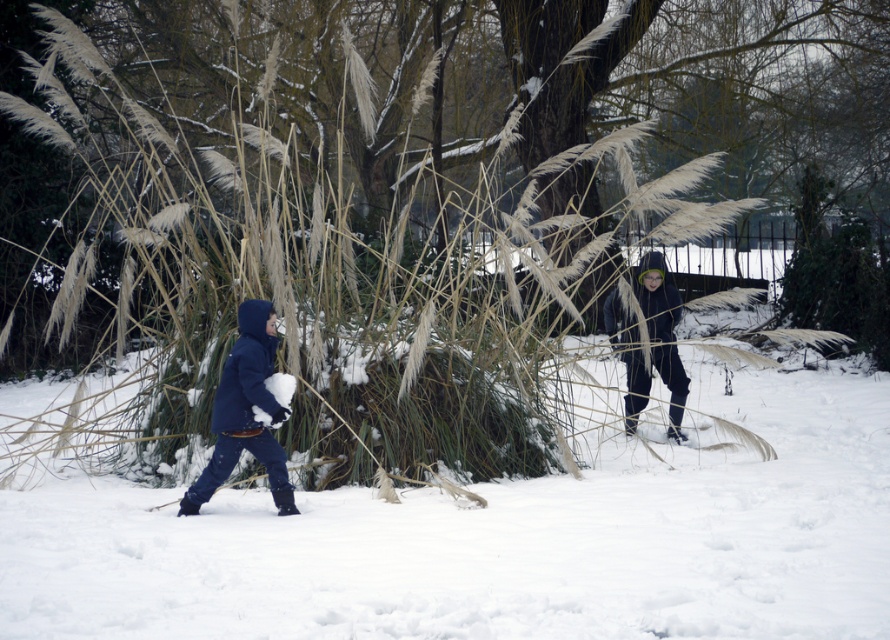
Looking at this image, you are a photographer trying to capture a wide shot of the winter scene. The white fluffy snow at center and the dark blue hooded jacket at center are both in your frame. Since you want to emphasize the vastness of the snow, would the snow appear wider than the jacket in your photo?

Yes, the white fluffy snow at center appears wider than the dark blue hooded jacket at center in the photo because its width surpasses that of the jacket.

You are a photographer trying to capture the two children in the scene. You want to ensure that the white fluffy snow at center and the dark blue hooded jacket at center are both visible in the frame. Based on their positions, which object should you focus on first to ensure both are in focus?

The white fluffy snow at center is positioned on the left side of dark blue hooded jacket at center. To ensure both are in focus, you should focus on the dark blue hooded jacket at center first since it is closer to the camera than the white fluffy snow at center.

You are a parent trying to dress your child in warm clothing for the winter scene described. Given the two options available, the matte blue coat at left and the dark blue hooded jacket at center, which one would provide better coverage for the child based on their length?

The dark blue hooded jacket at center is taller than the matte blue coat at left, so it would provide better coverage for the child.